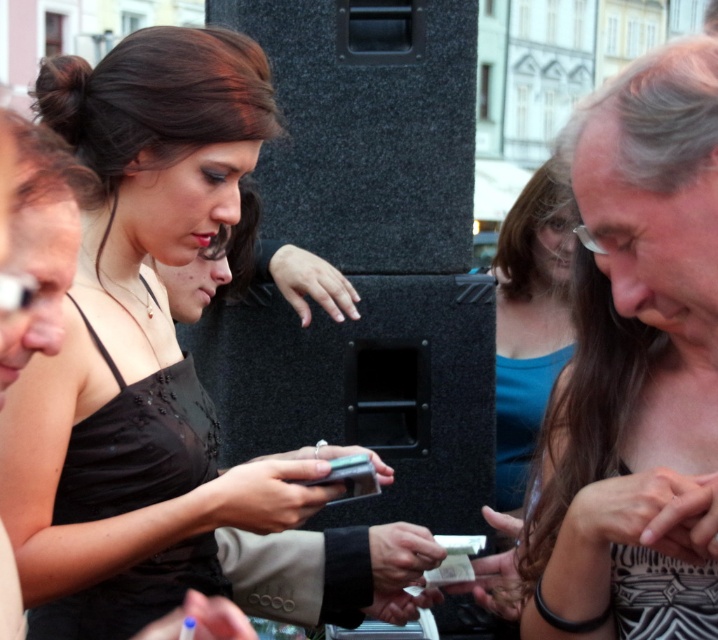
Question: Which of the following is the farthest from the observer?

Choices:
 (A) matte black dress at center
 (B) black glossy smartphone at center
 (C) blue fabric shirt at center
 (D) gray textured hair at center

Answer: (C)

Question: Which of the following is the closest to the observer?

Choices:
 (A) blue fabric shirt at center
 (B) matte black dress at center

Answer: (B)

Question: Does gray textured hair at center appear on the right side of black glossy smartphone at center?

Choices:
 (A) yes
 (B) no

Answer: (A)

Question: Which point is closer to the camera?

Choices:
 (A) gray textured hair at center
 (B) matte black dress at center
 (C) blue fabric shirt at center

Answer: (B)

Question: Can you confirm if matte black dress at center is bigger than blue fabric shirt at center?

Choices:
 (A) no
 (B) yes

Answer: (B)

Question: Is matte black dress at center to the right of blue fabric shirt at center from the viewer's perspective?

Choices:
 (A) yes
 (B) no

Answer: (B)